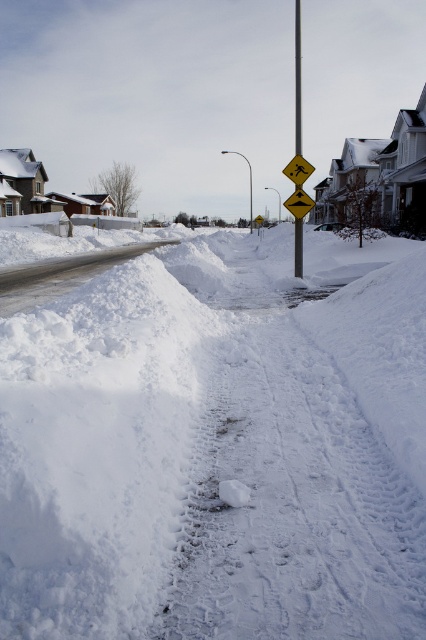
Question: Which point is farther to the camera?

Choices:
 (A) white fluffy snow at center
 (B) yellow reflective diamond at center

Answer: (B)

Question: Which point is closer to the camera?

Choices:
 (A) 296,144
 (B) 293,177

Answer: (B)

Question: Which point appears closest to the camera in this image?

Choices:
 (A) (296, 156)
 (B) (37, 348)

Answer: (B)

Question: Does white fluffy snow at center have a smaller size compared to yellow reflective diamond at center?

Choices:
 (A) yes
 (B) no

Answer: (B)

Question: Does white fluffy snow at center appear over metallic pole at center?

Choices:
 (A) no
 (B) yes

Answer: (A)

Question: Does white fluffy snow at center appear under yellow reflective diamond at center?

Choices:
 (A) no
 (B) yes

Answer: (B)